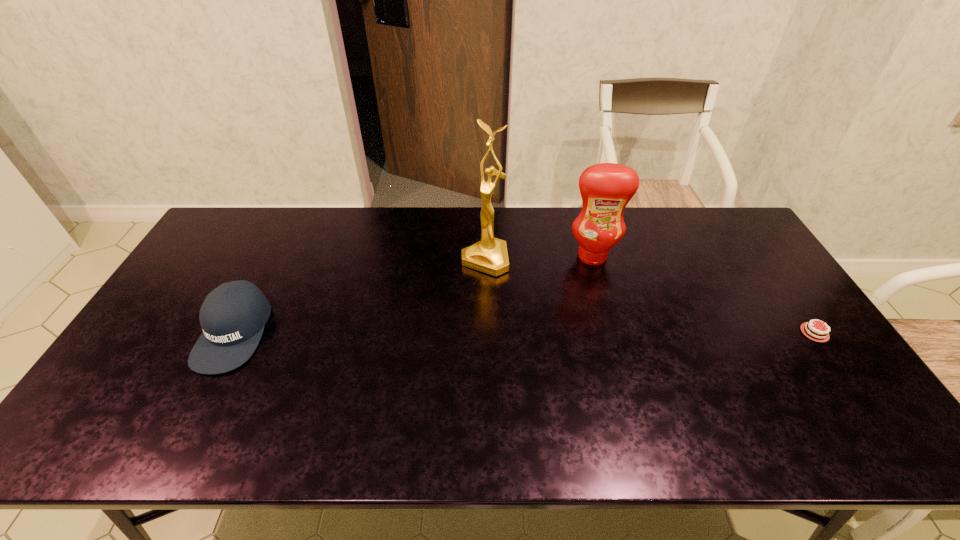
Find the location of a particular element. baseball cap is located at coordinates (233, 316).

Locate an element on the screen. The image size is (960, 540). the third tallest object is located at coordinates (233, 316).

Locate an element on the screen. This screenshot has height=540, width=960. the shortest object is located at coordinates (821, 337).

Image resolution: width=960 pixels, height=540 pixels. I want to click on the rightmost object, so click(x=821, y=337).

I want to click on the third object from left to right, so click(606, 188).

The height and width of the screenshot is (540, 960). Identify the location of condiment. (606, 188).

Locate an element on the screen. the tallest object is located at coordinates (489, 255).

Identify the location of the second object from left to right. (489, 255).

What are the coordinates of `vacant space positioned 0.180m on the back of the chocolate cake` in the screenshot? It's located at (769, 267).

Where is `free point located 0.370m on the label side of the condiment`? The height and width of the screenshot is (540, 960). free point located 0.370m on the label side of the condiment is located at coordinates click(x=602, y=362).